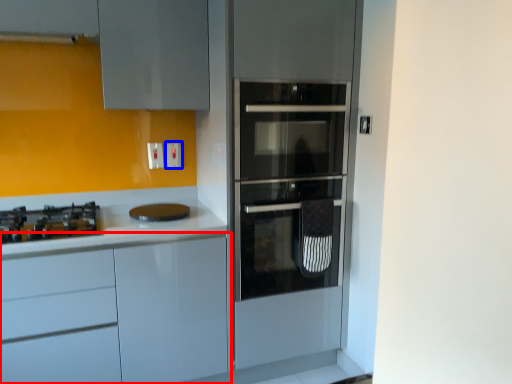
Question: Which of the following is the closest to the observer, cabinetry (highlighted by a red box) or electric outlet (highlighted by a blue box)?

Choices:
 (A) cabinetry
 (B) electric outlet

Answer: (A)